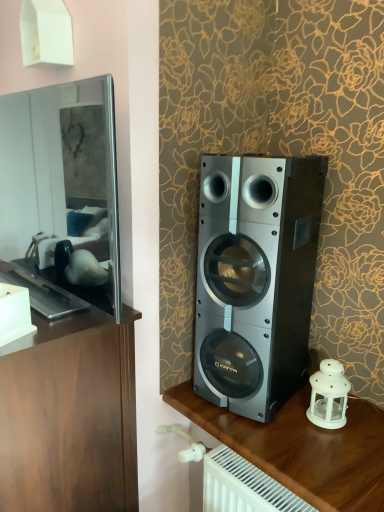
This screenshot has height=512, width=384. In order to click on unoccupied area in front of white matte lantern at lower right in this screenshot , I will do `click(332, 448)`.